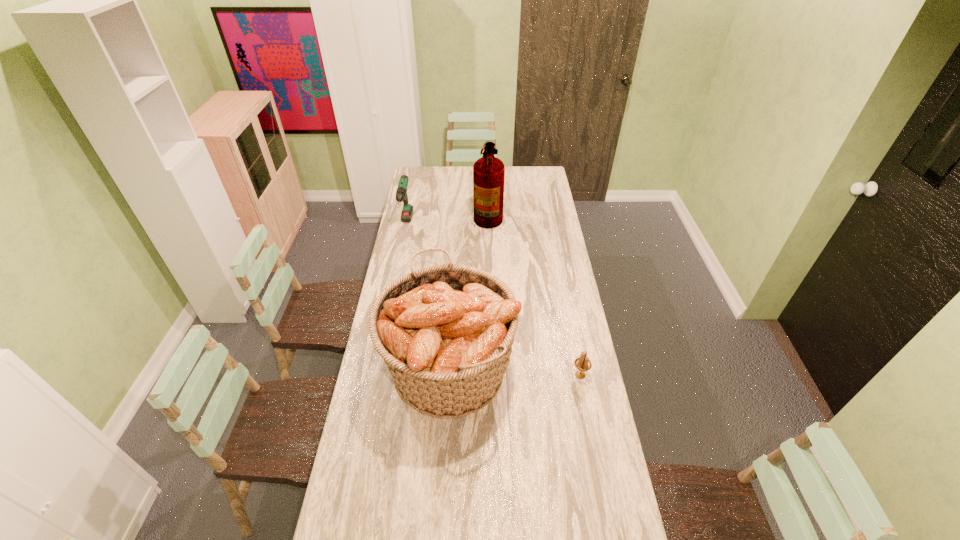
At what (x,y) coordinates should I click in order to perform the action: click on fire extinguisher. Please return your answer as a coordinate pair (x, y). Image resolution: width=960 pixels, height=540 pixels. Looking at the image, I should click on (488, 172).

Where is `the third shortest object`? The height and width of the screenshot is (540, 960). the third shortest object is located at coordinates (445, 332).

Find the location of a particular element. the leftmost object is located at coordinates (401, 194).

The image size is (960, 540). I want to click on drill, so click(x=401, y=194).

Locate an element on the screen. the shortest object is located at coordinates [x=583, y=364].

Where is `the rightmost object`? This screenshot has width=960, height=540. the rightmost object is located at coordinates (583, 364).

The image size is (960, 540). What are the coordinates of `vacant space located 0.130m at the nozzle of the tallest object` in the screenshot? It's located at (450, 214).

What are the coordinates of `vacant space located 0.290m at the nozzle of the tallest object` in the screenshot? It's located at (421, 214).

Image resolution: width=960 pixels, height=540 pixels. What are the coordinates of `free space located at the nozzle of the tallest object` in the screenshot? It's located at (416, 214).

I want to click on vacant space located 0.210m on the right of the third shortest object, so click(x=570, y=368).